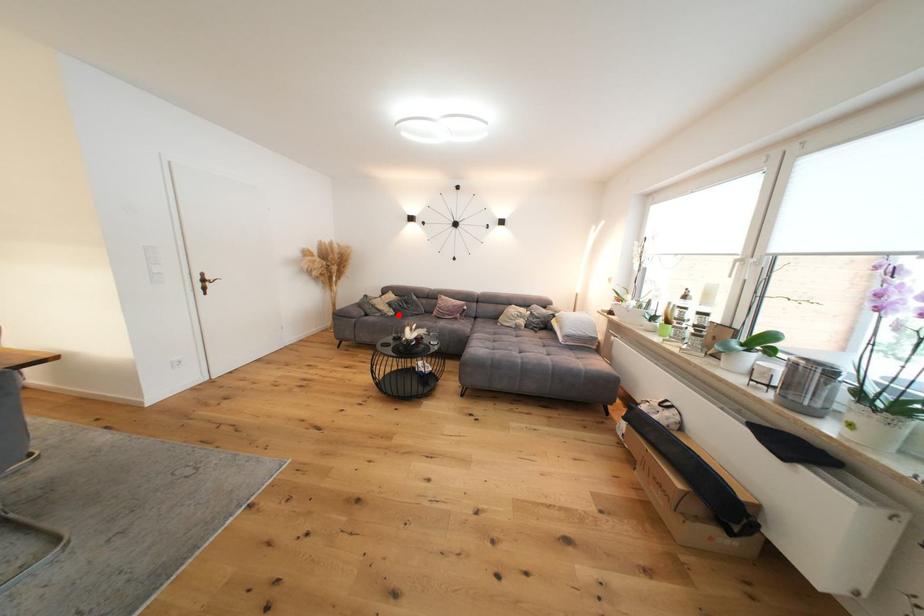
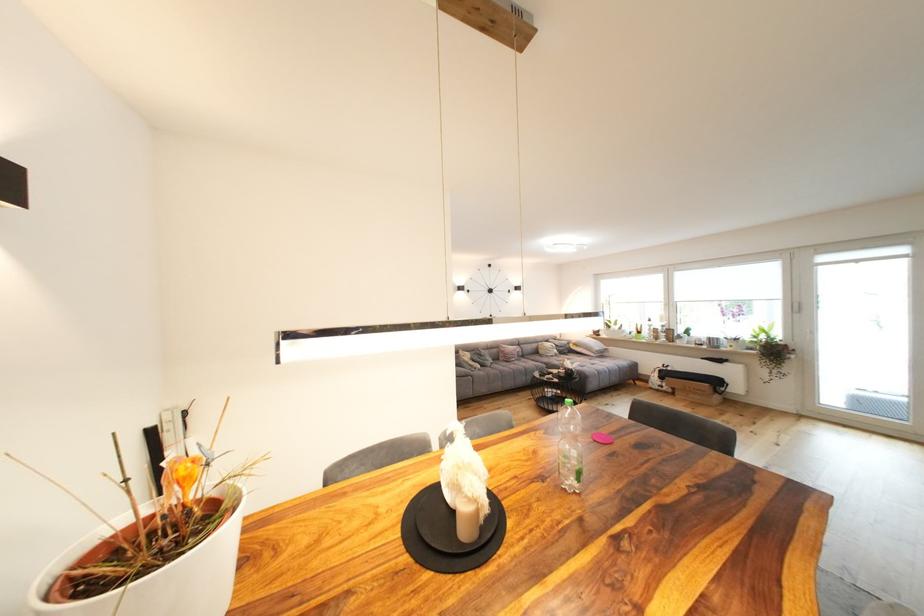
In the second image, find the point that corresponds to the highlighted location in the first image.

(485, 368)